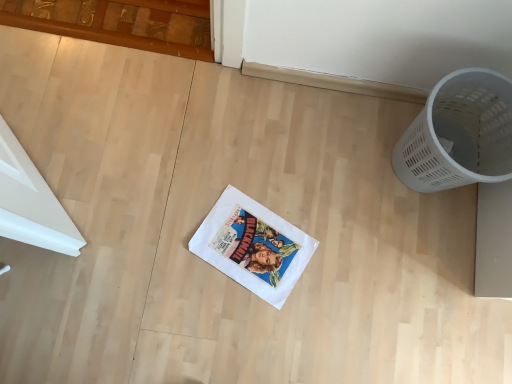
Question: Choose the correct answer: Is white paper comic book at center inside white plastic basket at right or outside it?

Choices:
 (A) outside
 (B) inside

Answer: (A)

Question: Does point (286, 246) appear closer or farther from the camera than point (499, 100)?

Choices:
 (A) closer
 (B) farther

Answer: (B)

Question: From the image's perspective, is white paper comic book at center above or below white plastic basket at right?

Choices:
 (A) below
 (B) above

Answer: (A)

Question: From a real-world perspective, is white plastic basket at right above or below white paper comic book at center?

Choices:
 (A) below
 (B) above

Answer: (B)

Question: Considering the positions of point (497, 132) and point (226, 259), is point (497, 132) closer or farther from the camera than point (226, 259)?

Choices:
 (A) closer
 (B) farther

Answer: (A)

Question: In terms of size, does white plastic basket at right appear bigger or smaller than white paper comic book at center?

Choices:
 (A) small
 (B) big

Answer: (B)

Question: From the image's perspective, relative to white paper comic book at center, is white plastic basket at right above or below?

Choices:
 (A) above
 (B) below

Answer: (A)